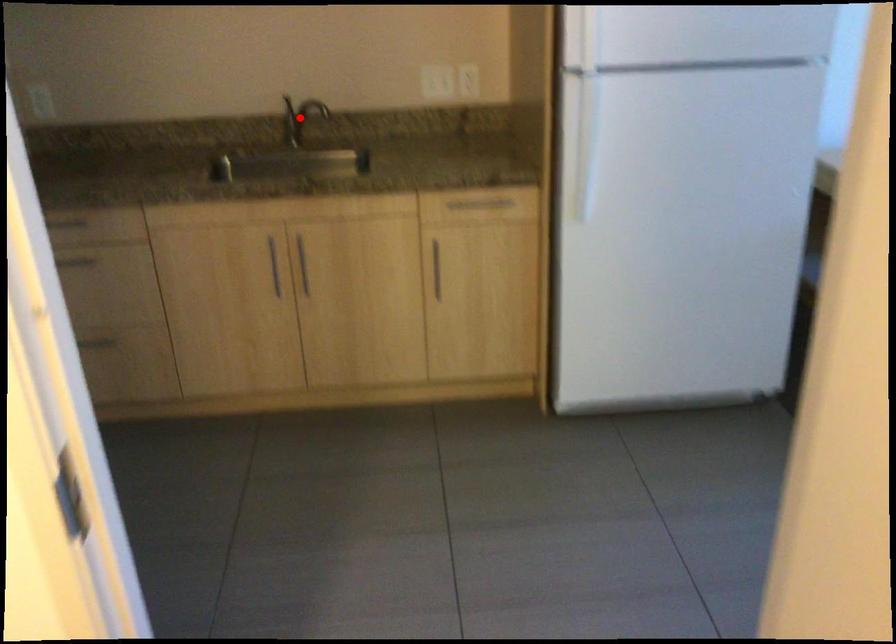
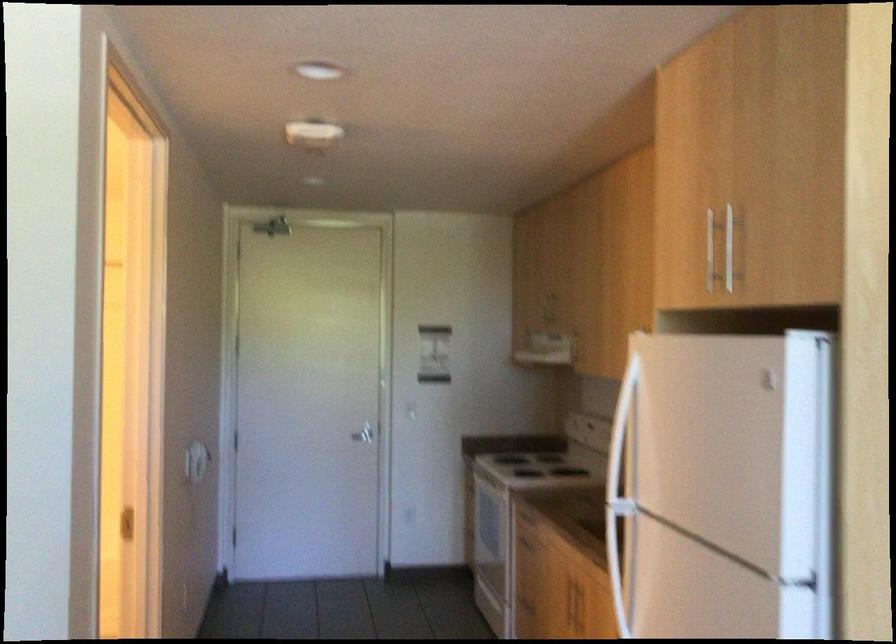
Question: I am providing you with two images of the same scene from different viewpoints. A red point is marked on the first image. Is the red point's position out of view in image 2?

Choices:
 (A) Yes
 (B) No

Answer: (A)